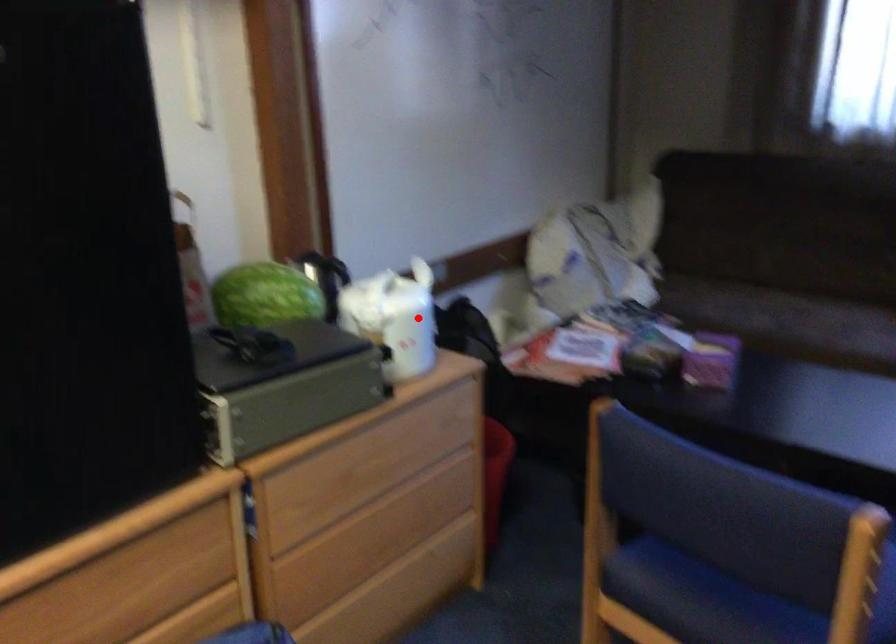
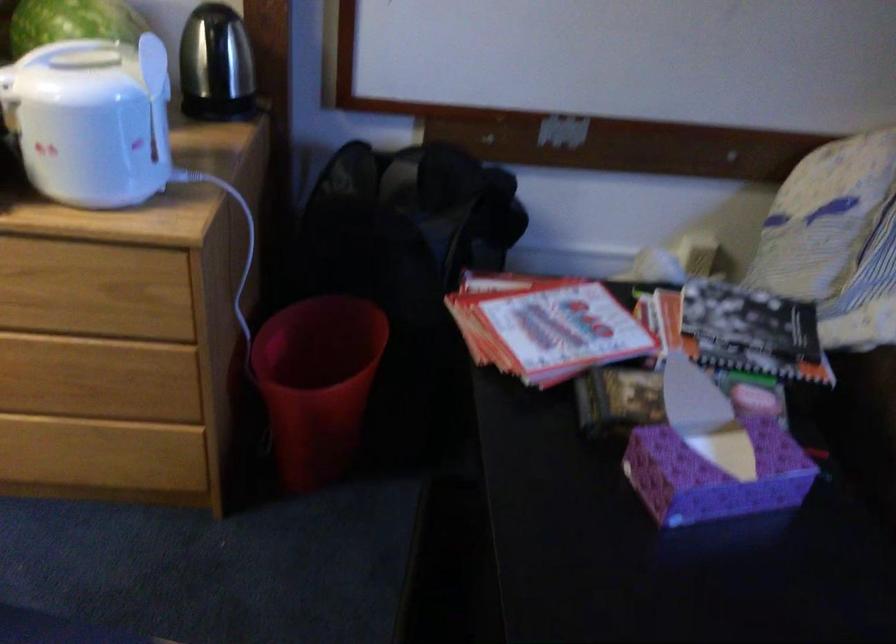
Where in the second image is the point corresponding to the highlighted location from the first image?

(91, 120)